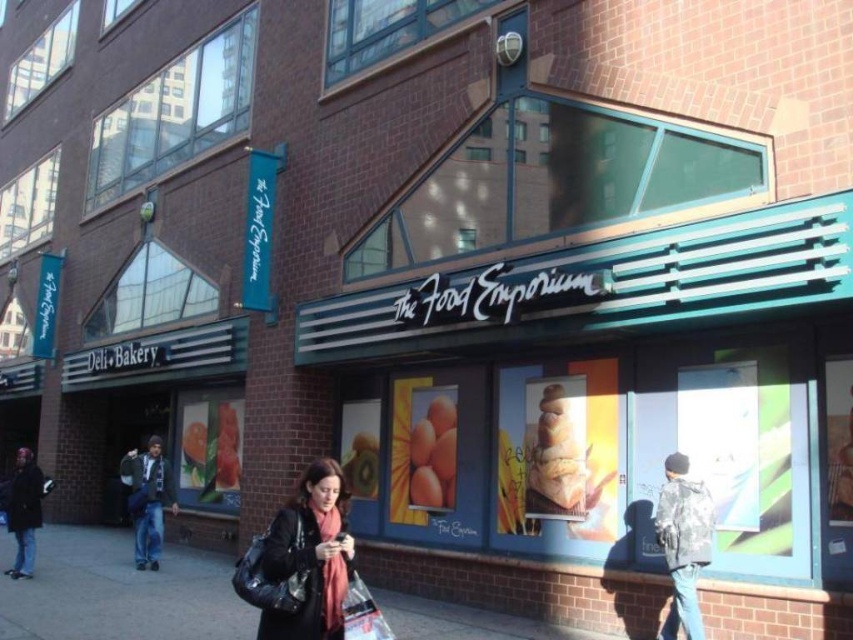
You are standing on the sidewalk in front of The Food Emporium. There are two points marked on the ground. One is at coordinates point (143, 456) and the other at point (357, 609). If you want to walk towards the entrance of the store, which point should you step on first?

You should step on point (357, 609) first because point (143, 456) is behind it, meaning point (357, 609) is closer to the entrance of The Food Emporium.

You are a delivery person who needs to pack two items into your available space. You have a black leather bag at center and a plastic shopping bag at lower center. Which bag should you choose if you need to carry more items?

The plastic shopping bag at lower center is larger than the black leather bag at center, so you should choose the plastic shopping bag at lower center to carry more items.